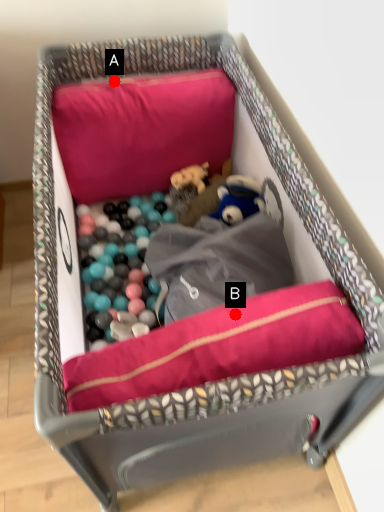
Question: Two points are circled on the image, labeled by A and B beside each circle. Which of the following is the closest to the observer?

Choices:
 (A) A is closer
 (B) B is closer

Answer: (B)